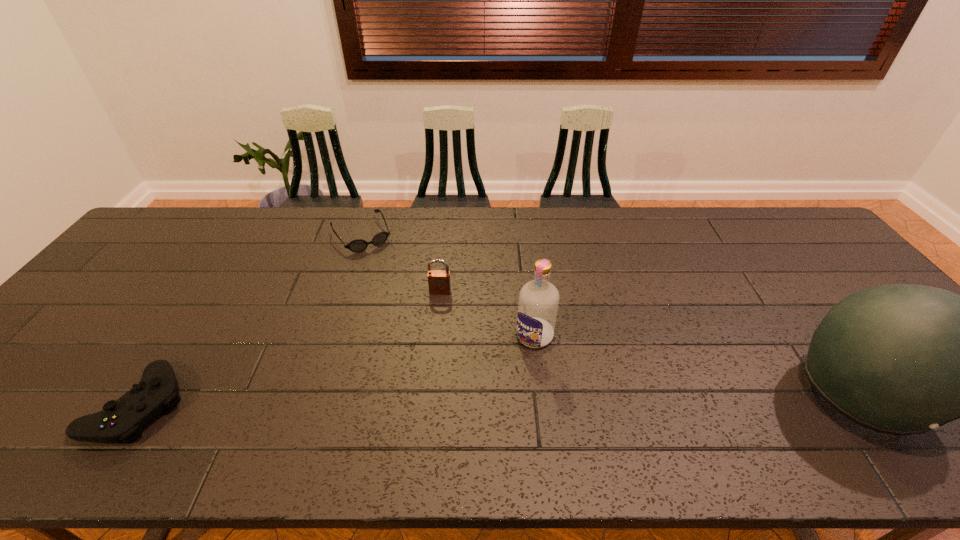
Image resolution: width=960 pixels, height=540 pixels. In order to click on the leftmost object in this screenshot , I will do `click(123, 420)`.

The height and width of the screenshot is (540, 960). I want to click on control, so pos(123,420).

Find the location of a particular element. The height and width of the screenshot is (540, 960). the second object from right to left is located at coordinates (537, 308).

You are a GUI agent. You are given a task and a screenshot of the screen. Output one action in this format:
    pyautogui.click(x=<x>, y=<y>)
    Task: Click on the vodka
    The width and height of the screenshot is (960, 540).
    Given the screenshot: What is the action you would take?
    pyautogui.click(x=537, y=308)

Where is `the fourth nearest object`? the fourth nearest object is located at coordinates (438, 280).

What are the coordinates of `padlock` in the screenshot? It's located at (438, 280).

The image size is (960, 540). In order to click on the shortest object in this screenshot , I will do `click(358, 245)`.

Where is `the farthest object`? Image resolution: width=960 pixels, height=540 pixels. the farthest object is located at coordinates (358, 245).

You are a GUI agent. You are given a task and a screenshot of the screen. Output one action in this format:
    pyautogui.click(x=<x>, y=<y>)
    Task: Click on the blank space located 0.240m on the right of the second shortest object
    The width and height of the screenshot is (960, 540).
    Given the screenshot: What is the action you would take?
    pyautogui.click(x=293, y=404)

Where is `free location located 0.150m on the label of the vodka`? free location located 0.150m on the label of the vodka is located at coordinates (492, 391).